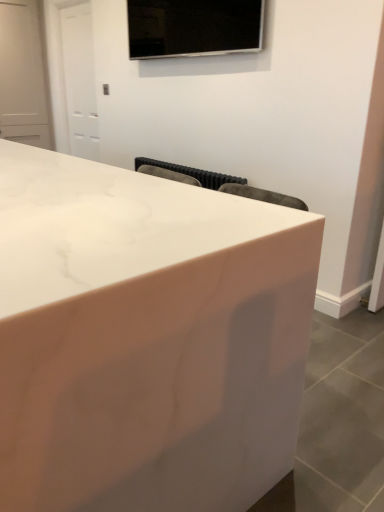
Question: Is black glossy tv at upper center not within white marble countertop at center?

Choices:
 (A) yes
 (B) no

Answer: (A)

Question: From a real-world perspective, is black glossy tv at upper center physically below white marble countertop at center?

Choices:
 (A) no
 (B) yes

Answer: (A)

Question: Considering the relative positions of black glossy tv at upper center and white marble countertop at center in the image provided, is black glossy tv at upper center to the right of white marble countertop at center from the viewer's perspective?

Choices:
 (A) yes
 (B) no

Answer: (A)

Question: From the image's perspective, is black glossy tv at upper center beneath white marble countertop at center?

Choices:
 (A) yes
 (B) no

Answer: (B)

Question: Considering the relative sizes of black glossy tv at upper center and white marble countertop at center in the image provided, is black glossy tv at upper center smaller than white marble countertop at center?

Choices:
 (A) yes
 (B) no

Answer: (A)

Question: From a real-world perspective, is black glossy tv at upper center on white marble countertop at center?

Choices:
 (A) no
 (B) yes

Answer: (B)

Question: Does white marble countertop at center come in front of black glossy tv at upper center?

Choices:
 (A) yes
 (B) no

Answer: (A)

Question: Can you confirm if white marble countertop at center is positioned to the right of black glossy tv at upper center?

Choices:
 (A) yes
 (B) no

Answer: (B)

Question: Is white marble countertop at center wider than black glossy tv at upper center?

Choices:
 (A) no
 (B) yes

Answer: (B)

Question: Is white marble countertop at center facing towards black glossy tv at upper center?

Choices:
 (A) yes
 (B) no

Answer: (B)

Question: Does white marble countertop at center have a lesser height compared to black glossy tv at upper center?

Choices:
 (A) yes
 (B) no

Answer: (B)

Question: Considering the relative sizes of white marble countertop at center and black glossy tv at upper center in the image provided, is white marble countertop at center bigger than black glossy tv at upper center?

Choices:
 (A) yes
 (B) no

Answer: (A)

Question: From a real-world perspective, is white marble countertop at center above or below black glossy tv at upper center?

Choices:
 (A) above
 (B) below

Answer: (B)